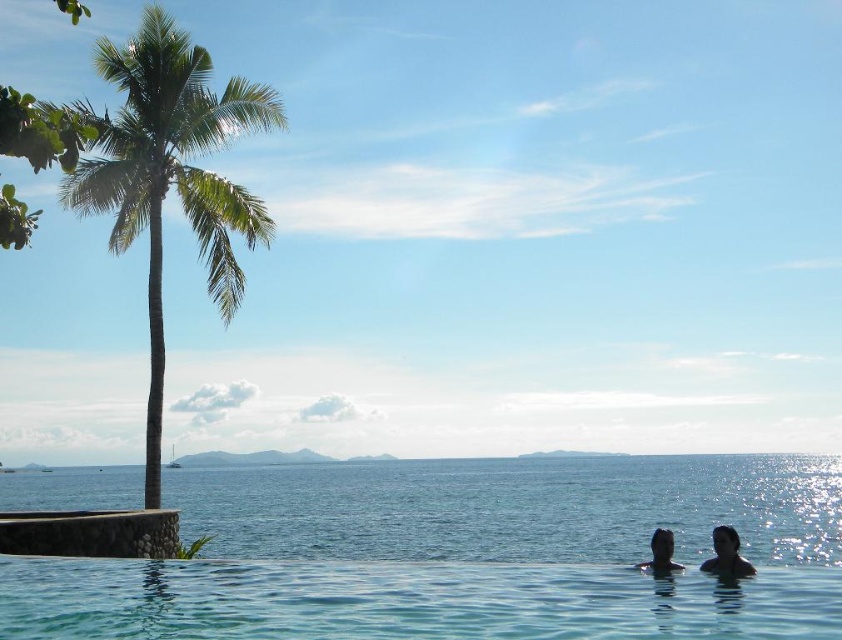
Question: Does transparent glass pool at lower center appear over green leafy palm tree at left?

Choices:
 (A) yes
 (B) no

Answer: (B)

Question: Does clear blue water at center have a lesser width compared to black matte head at lower right?

Choices:
 (A) yes
 (B) no

Answer: (B)

Question: Which point appears farthest from the camera in this image?

Choices:
 (A) (654, 550)
 (B) (734, 536)

Answer: (A)

Question: Which point is farther to the camera?

Choices:
 (A) green leafy palm tree at left
 (B) clear blue water at center
 (C) black matte head at lower right
 (D) dark skin human at lower right

Answer: (A)

Question: Which object is the closest to the black matte head at lower right?

Choices:
 (A) green leafy palm tree at left
 (B) dark skin human at lower right
 (C) clear blue water at center

Answer: (B)

Question: Is clear blue water at center wider than black matte head at lower right?

Choices:
 (A) yes
 (B) no

Answer: (A)